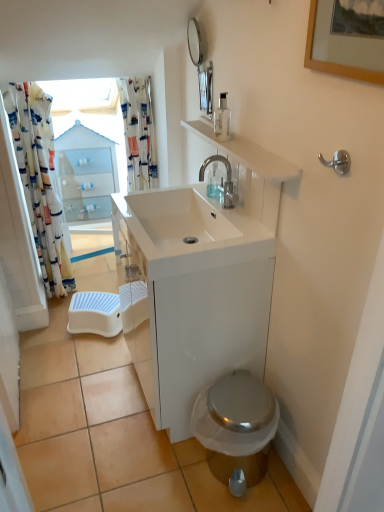
Image resolution: width=384 pixels, height=512 pixels. Identify the location of vacant point to the left of white glossy cabinet at center. (91, 389).